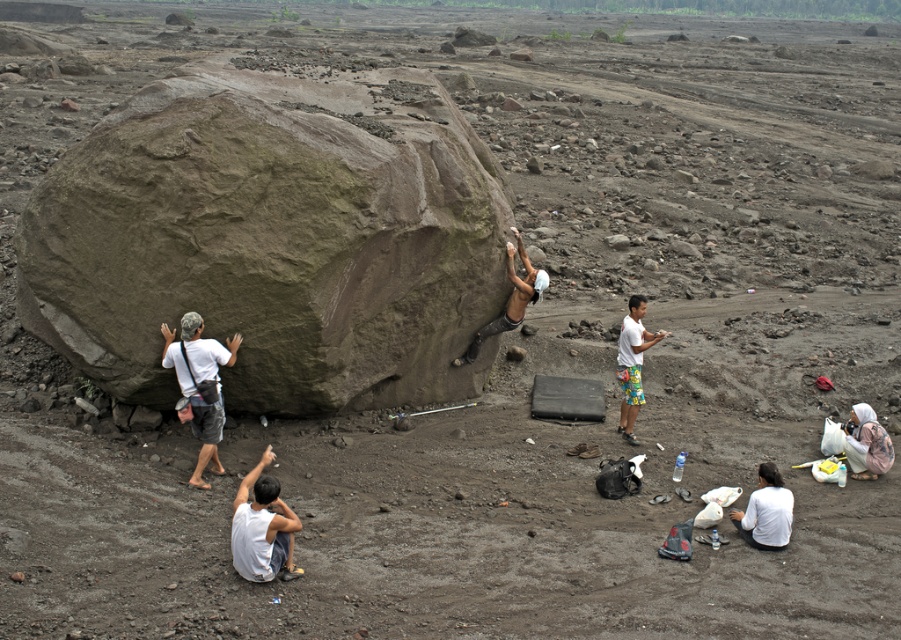
Does matte gray shorts at left appear on the right side of white cotton shirt at right?

No, matte gray shorts at left is not to the right of white cotton shirt at right.

The image size is (901, 640). Identify the location of matte gray shorts at left. (199, 381).

Who is taller, white cotton shirt at lower center or white cotton shirt at right?

white cotton shirt at right is taller.

In the scene shown: Which is more to the right, white cotton shirt at lower center or white cotton shirt at right?

white cotton shirt at right is more to the right.

The height and width of the screenshot is (640, 901). Identify the location of white cotton shirt at lower center. (262, 528).

Identify the location of white cotton shirt at lower center. The image size is (901, 640). click(262, 528).

Does green rough rock at left have a greater height compared to white cotton shirt at lower center?

Incorrect, green rough rock at left's height is not larger of white cotton shirt at lower center's.

Which is more to the left, green rough rock at left or white cotton shirt at lower center?

Positioned to the left is white cotton shirt at lower center.

In order to click on green rough rock at left in this screenshot , I will do `click(271, 241)`.